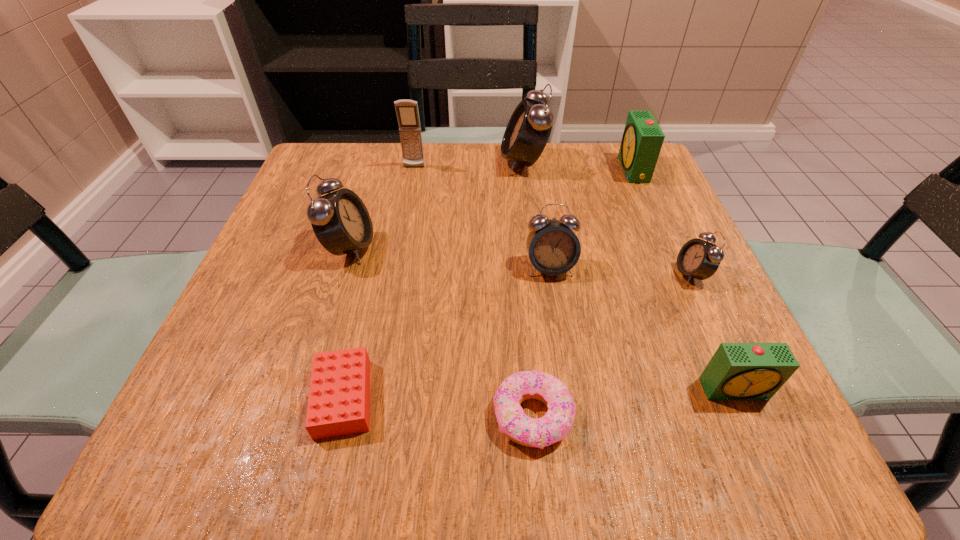
At what (x,y) coordinates should I click in order to perform the action: click on doughnut that is at the near edge. Please return your answer as a coordinate pair (x, y). Looking at the image, I should click on (554, 426).

Identify the location of object at the left edge. The image size is (960, 540). (340, 220).

The image size is (960, 540). I want to click on object present at the far right corner, so click(642, 140).

Find the location of a particular element. The height and width of the screenshot is (540, 960). object present at the near right corner is located at coordinates (737, 371).

What are the coordinates of `vacant region at the far edge of the desktop` in the screenshot? It's located at (465, 160).

In the image, there is a desktop. Identify the location of free space at the near edge. (409, 421).

In the image, there is a desktop. Identify the location of vacant area at the left edge. This screenshot has height=540, width=960. (300, 258).

Identify the location of vacant space at the right edge. (652, 202).

Image resolution: width=960 pixels, height=540 pixels. In order to click on free space at the far left corner of the desktop in this screenshot , I will do `click(363, 169)`.

Find the location of `vacant space at the near left corner of the desktop`. vacant space at the near left corner of the desktop is located at coordinates (237, 409).